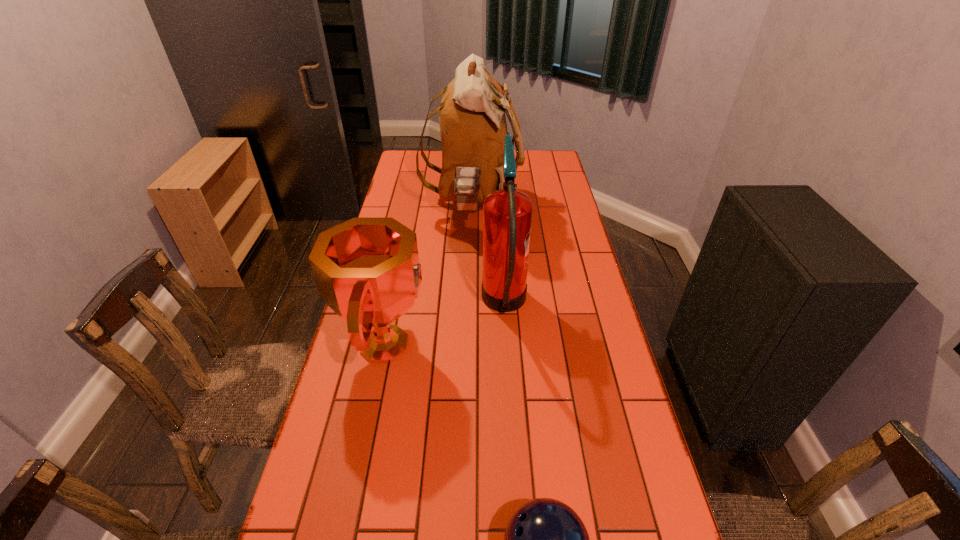
This screenshot has height=540, width=960. Find the location of `vacant space at the far left corner`. vacant space at the far left corner is located at coordinates (410, 156).

At what (x,y) coordinates should I click in order to perform the action: click on free space between the fire extinguisher and the second shortest object. Please return your answer as a coordinate pair (x, y). Looking at the image, I should click on (445, 325).

Locate an element on the screen. The height and width of the screenshot is (540, 960). free space between the fire extinguisher and the second shortest object is located at coordinates click(445, 325).

In order to click on free space between the backpack and the award in this screenshot , I will do `click(429, 275)`.

The image size is (960, 540). Identify the location of the closest object to the nearest object. (367, 270).

You are a GUI agent. You are given a task and a screenshot of the screen. Output one action in this format:
    pyautogui.click(x=<x>, y=<y>)
    Task: Click on the object that stands as the third closest to the backpack
    This screenshot has height=540, width=960.
    Given the screenshot: What is the action you would take?
    pyautogui.click(x=545, y=539)

The height and width of the screenshot is (540, 960). I want to click on vacant area in the image that satisfies the following two spatial constraints: 1. on the front-facing side of the fire extinguisher; 2. on the left side of the backpack, so click(470, 305).

Image resolution: width=960 pixels, height=540 pixels. Identify the location of vacant space that satisfies the following two spatial constraints: 1. on the front side of the fire extinguisher; 2. on the side of the third tallest object with the star emblem. (507, 345).